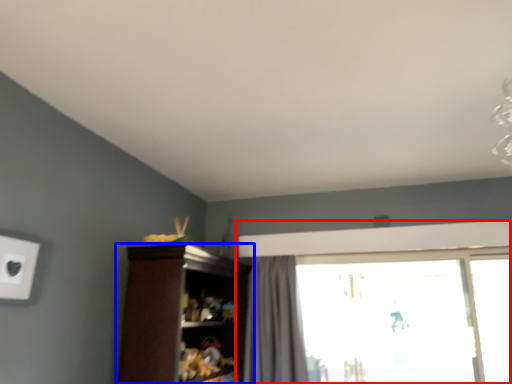
Question: Which of the following is the farthest to the observer, window (highlighted by a red box) or cupboard (highlighted by a blue box)?

Choices:
 (A) window
 (B) cupboard

Answer: (A)